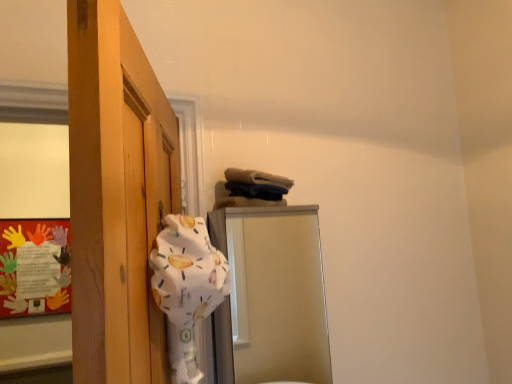
What are the coordinates of `metallic silver mirror at center` in the screenshot? It's located at (271, 296).

The width and height of the screenshot is (512, 384). In order to click on multicolored paper at left in this screenshot , I will do `click(34, 267)`.

The width and height of the screenshot is (512, 384). What are the coordinates of `white fabric at left` in the screenshot? It's located at (187, 271).

Would you say multicolored paper at left is to the left or to the right of metallic silver mirror at center in the picture?

multicolored paper at left is positioned on metallic silver mirror at center's left side.

From the image's perspective, is multicolored paper at left beneath metallic silver mirror at center?

Indeed, from the image's perspective, multicolored paper at left is shown beneath metallic silver mirror at center.

In terms of height, does multicolored paper at left look taller or shorter compared to metallic silver mirror at center?

Considering their sizes, multicolored paper at left has less height than metallic silver mirror at center.

Is multicolored paper at left inside or outside of metallic silver mirror at center?

multicolored paper at left cannot be found inside metallic silver mirror at center.

Can you confirm if white fabric at left is positioned to the left of multicolored paper at left?

In fact, white fabric at left is to the right of multicolored paper at left.

From the picture: From the image's perspective, is white fabric at left above or below multicolored paper at left?

Clearly, from the image's perspective, white fabric at left is above multicolored paper at left.

How many degrees apart are the facing directions of white fabric at left and multicolored paper at left?

The angular difference between white fabric at left and multicolored paper at left is 68.7 degrees.

Considering the sizes of objects white fabric at left and metallic silver mirror at center in the image provided, who is thinner, white fabric at left or metallic silver mirror at center?

Thinner between the two is white fabric at left.

Do you think white fabric at left is within metallic silver mirror at center, or outside of it?

white fabric at left is outside metallic silver mirror at center.

From a real-world perspective, is white fabric at left physically above metallic silver mirror at center?

Indeed, from a real-world perspective, white fabric at left stands above metallic silver mirror at center.

Consider the image. Is multicolored paper at left looking in the opposite direction of white fabric at left?

multicolored paper at left is not turned away from white fabric at left.

Is point (40, 243) farther from viewer compared to point (175, 323)?

Yes, point (40, 243) is behind point (175, 323).

Does multicolored paper at left have a lesser height compared to white fabric at left?

In fact, multicolored paper at left may be taller than white fabric at left.

Is the position of metallic silver mirror at center less distant than that of white fabric at left?

That is False.

Is metallic silver mirror at center oriented away from white fabric at left?

No.

From the image's perspective, is metallic silver mirror at center below white fabric at left?

Yes.

Could you tell me if metallic silver mirror at center is facing multicolored paper at left?

No, metallic silver mirror at center does not turn towards multicolored paper at left.

Is metallic silver mirror at center further to camera compared to multicolored paper at left?

No, metallic silver mirror at center is closer to the viewer.

From the image's perspective, is metallic silver mirror at center located above multicolored paper at left?

Yes.

Does metallic silver mirror at center have a lesser width compared to multicolored paper at left?

Incorrect, the width of metallic silver mirror at center is not less than that of multicolored paper at left.

Where is `bulletin board on the left of metallic silver mirror at center`? bulletin board on the left of metallic silver mirror at center is located at coordinates (34, 267).

The width and height of the screenshot is (512, 384). What are the coordinates of `bath towel beneath the multicolored paper at left (from a real-world perspective)` in the screenshot? It's located at (187, 271).

Which object lies further to the anchor point multicolored paper at left, metallic silver mirror at center or white fabric at left?

The object further to multicolored paper at left is white fabric at left.

When comparing their distances from white fabric at left, does metallic silver mirror at center or multicolored paper at left seem further?

Among the two, metallic silver mirror at center is located further to white fabric at left.

From the image, which object appears to be nearer to metallic silver mirror at center, multicolored paper at left or white fabric at left?

multicolored paper at left is positioned closer to the anchor metallic silver mirror at center.

Estimate the real-world distances between objects in this image. Which object is closer to white fabric at left, multicolored paper at left or metallic silver mirror at center?

multicolored paper at left.

Estimate the real-world distances between objects in this image. Which object is further from multicolored paper at left, white fabric at left or metallic silver mirror at center?

white fabric at left is positioned further to the anchor multicolored paper at left.

Estimate the real-world distances between objects in this image. Which object is further from metallic silver mirror at center, white fabric at left or multicolored paper at left?

white fabric at left lies further to metallic silver mirror at center than the other object.

Where is `mirror between white fabric at left and multicolored paper at left along the z-axis`? This screenshot has height=384, width=512. mirror between white fabric at left and multicolored paper at left along the z-axis is located at coordinates (271, 296).